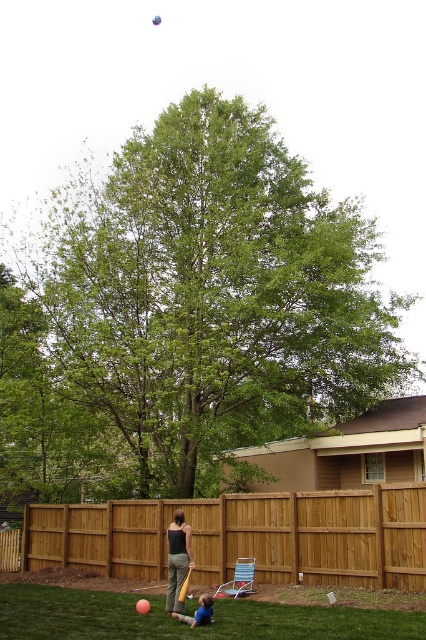
Question: Can you confirm if green leafy tree at center is thinner than dark green fabric pants at center?

Choices:
 (A) yes
 (B) no

Answer: (B)

Question: Which is nearer to the orange wood baseball bat at center?

Choices:
 (A) blue fabric shirt at lower center
 (B) brown wooden fence at center
 (C) dark green fabric pants at center
 (D) green leafy tree at center

Answer: (C)

Question: Which object appears closest to the camera in this image?

Choices:
 (A) green leafy tree at center
 (B) orange wood baseball bat at center
 (C) brown wooden fence at center
 (D) dark green fabric pants at center

Answer: (B)

Question: Which of the following is the farthest from the observer?

Choices:
 (A) (181, 516)
 (B) (339, 568)
 (C) (224, 164)

Answer: (C)

Question: Does green leafy tree at center appear under orange wood baseball bat at center?

Choices:
 (A) no
 (B) yes

Answer: (A)

Question: Where is green leafy tree at center located in relation to blue fabric shirt at lower center in the image?

Choices:
 (A) left
 (B) right

Answer: (A)